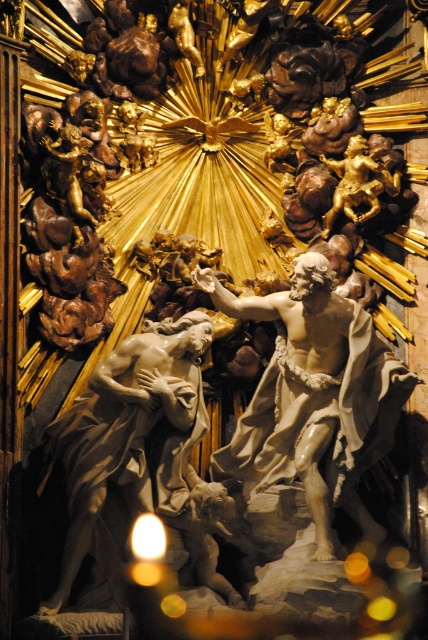
Question: Which object is farther from the camera taking this photo?

Choices:
 (A) matte white statue at center
 (B) white marble statue at center

Answer: (B)

Question: Which point is farther from the camera taking this photo?

Choices:
 (A) (169, 502)
 (B) (216, 289)

Answer: (B)

Question: Which object appears farthest from the camera in this image?

Choices:
 (A) matte white statue at center
 (B) white marble statue at center

Answer: (B)

Question: Considering the relative positions of white marble statue at center and matte white statue at center in the image provided, where is white marble statue at center located with respect to matte white statue at center?

Choices:
 (A) above
 (B) below

Answer: (A)

Question: Is white marble statue at center smaller than matte white statue at center?

Choices:
 (A) no
 (B) yes

Answer: (A)

Question: Does white marble statue at center have a larger size compared to matte white statue at center?

Choices:
 (A) no
 (B) yes

Answer: (B)